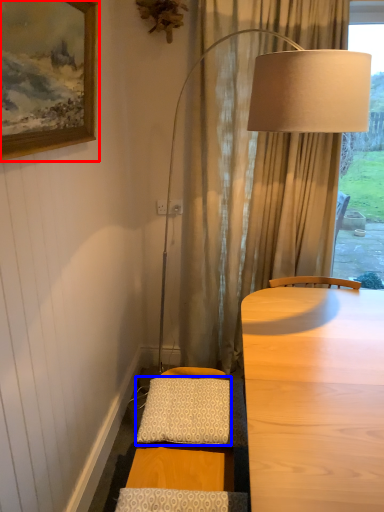
Question: Which point is closer to the camera, picture frame (highlighted by a red box) or pillow (highlighted by a blue box)?

Choices:
 (A) picture frame
 (B) pillow

Answer: (A)